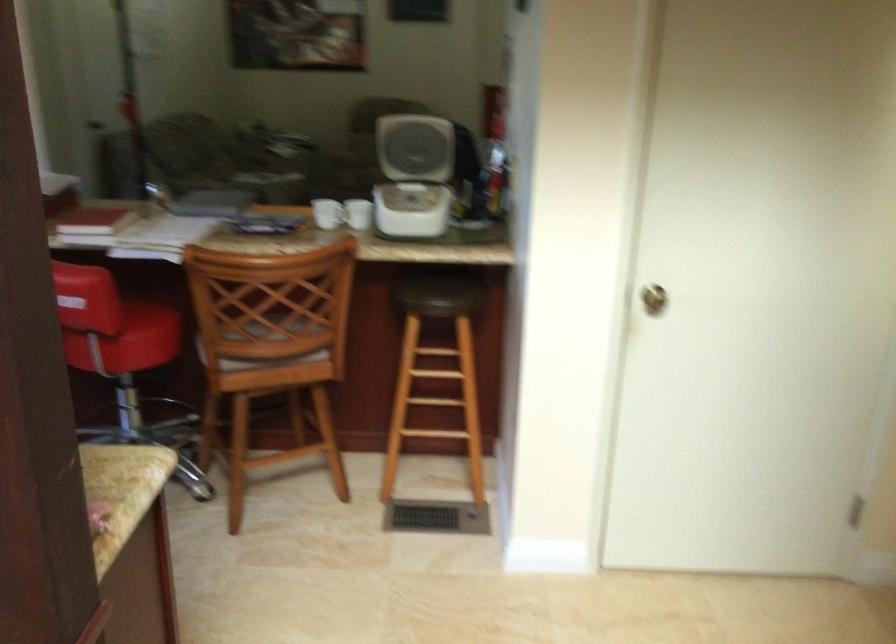
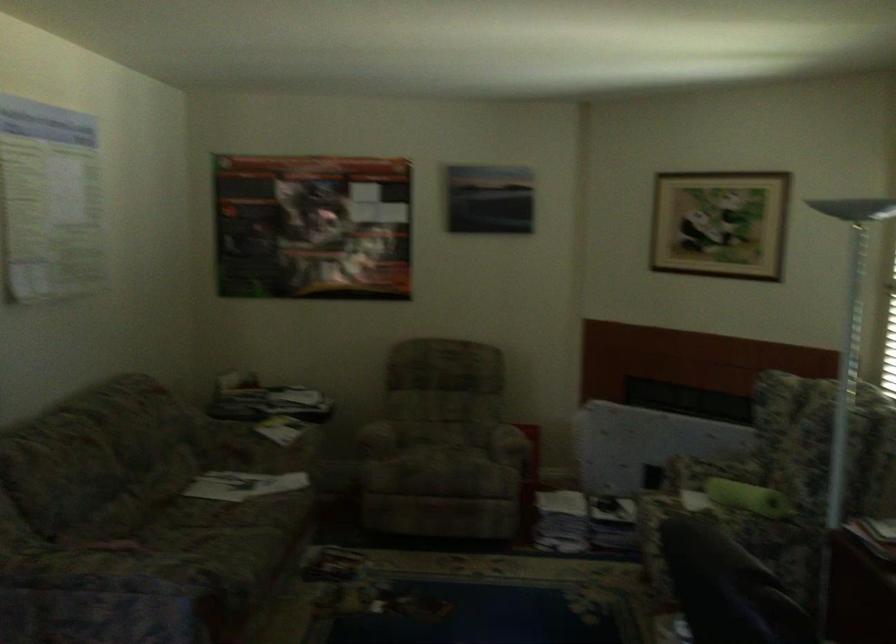
Locate, in the second image, the point that corresponds to (x=234, y=156) in the first image.

(217, 488)